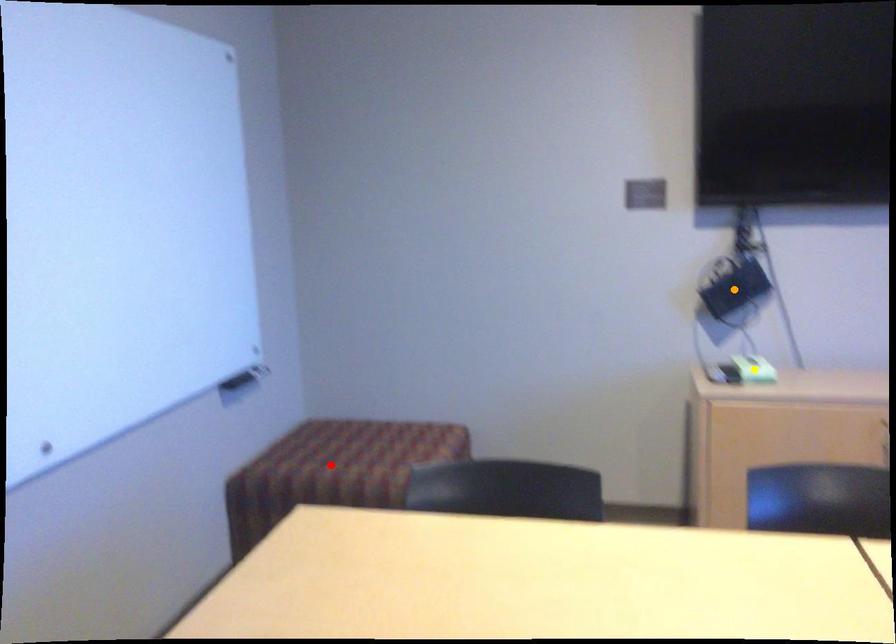
Order these from nearest to farthest:
1. red point
2. yellow point
3. orange point

yellow point → red point → orange point